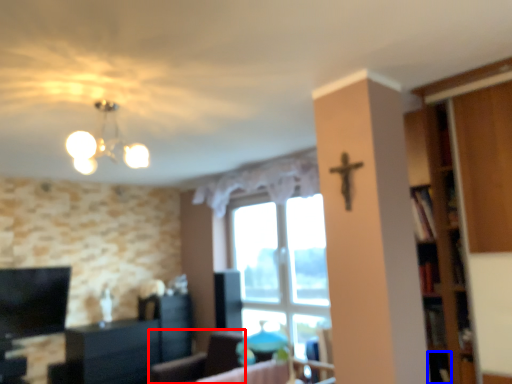
Question: Which object is closer to the camera taking this photo, furniture (highlighted by a red box) or shelf (highlighted by a blue box)?

Choices:
 (A) furniture
 (B) shelf

Answer: (B)